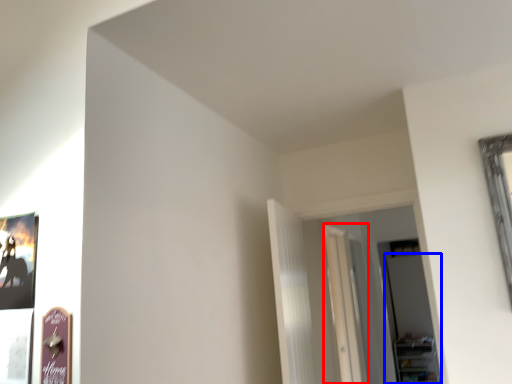
Question: Which object is further to the camera taking this photo, glass door (highlighted by a red box) or glass door (highlighted by a blue box)?

Choices:
 (A) glass door
 (B) glass door

Answer: (B)